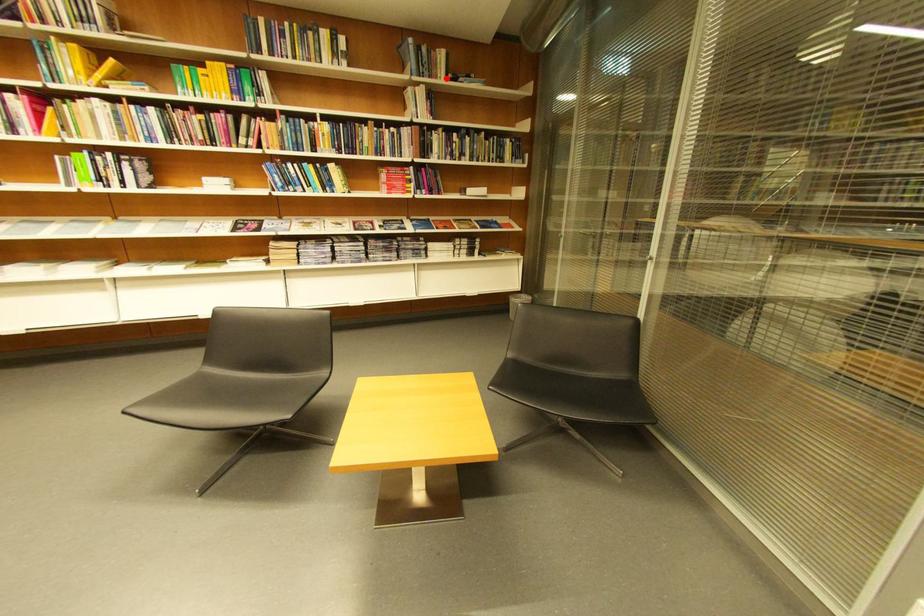
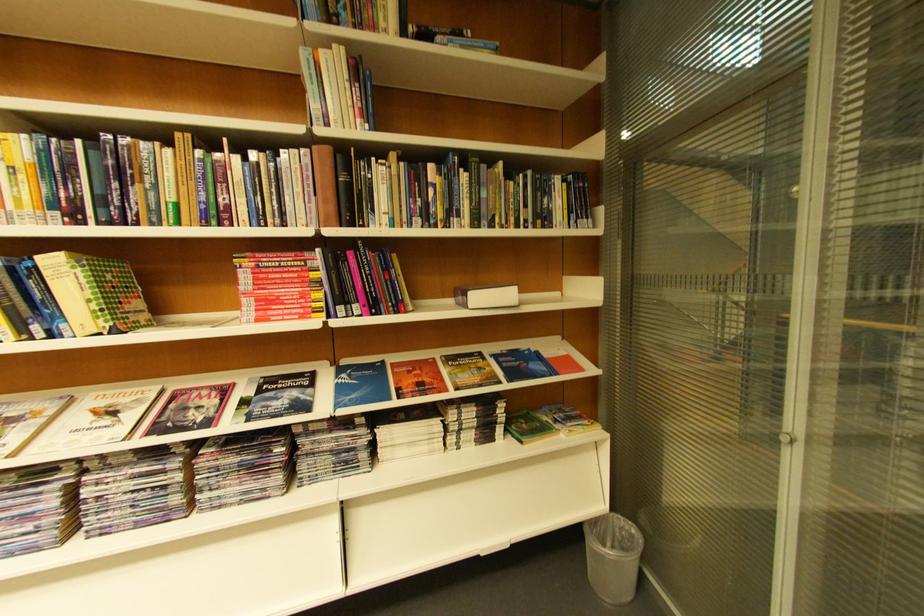
Where in the second image is the point corresponding to the highlighted location from the first image?

(384, 31)